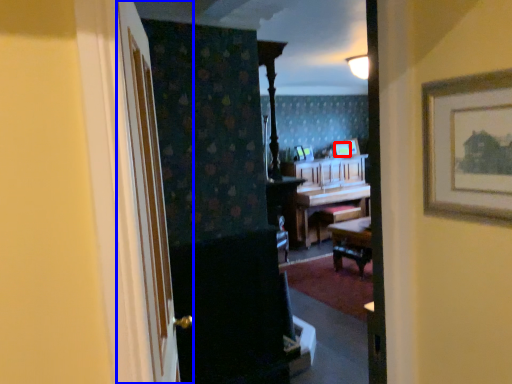
Question: Which object appears closest to the camera in this image, picture frame (highlighted by a red box) or door (highlighted by a blue box)?

Choices:
 (A) picture frame
 (B) door

Answer: (B)